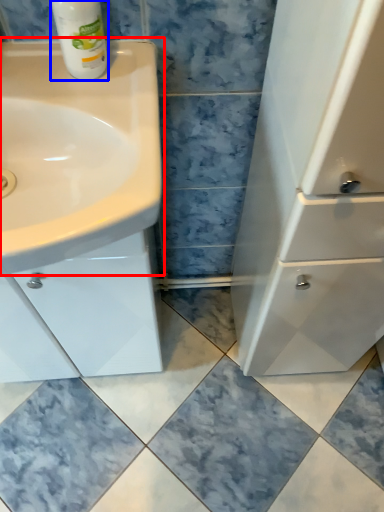
Question: Which object is further to the camera taking this photo, sink (highlighted by a red box) or cleaning product (highlighted by a blue box)?

Choices:
 (A) sink
 (B) cleaning product

Answer: (B)